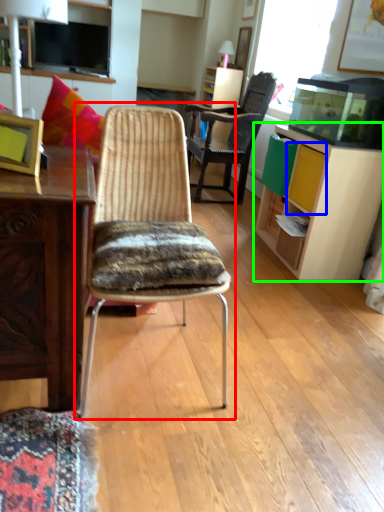
Question: Which object is the closest to the chair (highlighted by a red box)? Choose among these: drawer (highlighted by a blue box) or cabinetry (highlighted by a green box).

Choices:
 (A) drawer
 (B) cabinetry

Answer: (A)